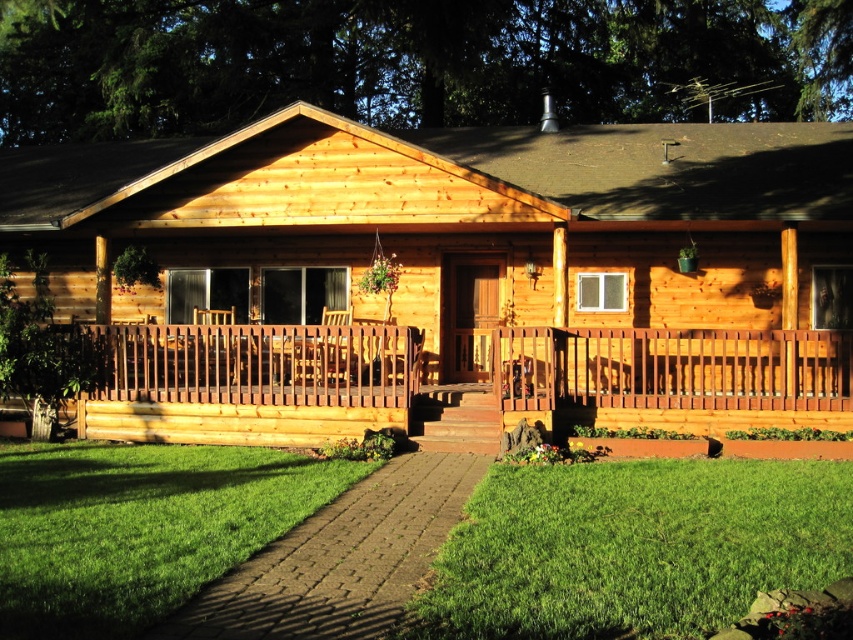
Question: Estimate the real-world distances between objects in this image. Which object is closer to the natural wood cabin at center?

Choices:
 (A) green leafy tree at upper center
 (B) green grass at lower left
 (C) green grass at lower center
 (D) natural wood porch at center

Answer: (D)

Question: Which point is farther from the camera taking this photo?

Choices:
 (A) (316, 508)
 (B) (744, 550)
 (C) (752, 422)
 (D) (756, 237)

Answer: (D)

Question: Can you confirm if natural wood porch at center is wider than green grass at lower left?

Choices:
 (A) yes
 (B) no

Answer: (A)

Question: Where is green grass at lower center located in relation to green grass at lower left in the image?

Choices:
 (A) left
 (B) right

Answer: (B)

Question: Based on their relative distances, which object is nearer to the green grass at lower left?

Choices:
 (A) natural wood porch at center
 (B) green grass at lower center
 (C) green leafy tree at upper center
 (D) natural wood cabin at center

Answer: (B)

Question: Is green leafy tree at upper center to the right of natural wood porch at center from the viewer's perspective?

Choices:
 (A) no
 (B) yes

Answer: (A)